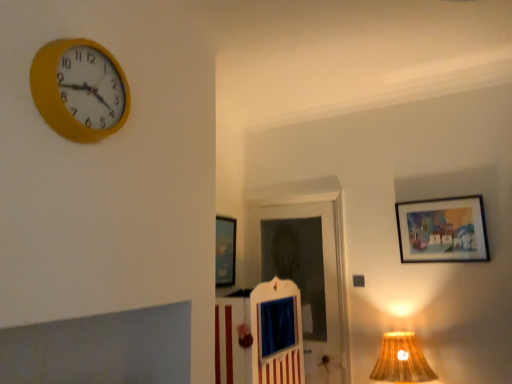
Question: Looking at the image, does metallic silver picture frame at center, which is counted as the first picture frame, starting from the left, seem bigger or smaller compared to matte wooden picture frame at upper right, which is counted as the 1th picture frame, starting from the front?

Choices:
 (A) big
 (B) small

Answer: (A)

Question: Is metallic silver picture frame at center, which is counted as the first picture frame, starting from the left, in front of or behind matte wooden picture frame at upper right, arranged as the 2th picture frame when viewed from the back, in the image?

Choices:
 (A) front
 (B) behind

Answer: (B)

Question: Which object is the farthest from the yellow plastic wall clock at upper left?

Choices:
 (A) metallic silver picture frame at center, which is counted as the first picture frame, starting from the left
 (B) braided fabric lampshade at lower right
 (C) white wooden door at center
 (D) matte wooden picture frame at upper right, the second picture frame when ordered from left to right

Answer: (D)

Question: Estimate the real-world distances between objects in this image. Which object is closer to the matte wooden picture frame at upper right, which is counted as the 1th picture frame, starting from the front?

Choices:
 (A) white wooden door at center
 (B) braided fabric lampshade at lower right
 (C) metallic silver picture frame at center, arranged as the second picture frame when viewed from the right
 (D) yellow plastic wall clock at upper left

Answer: (B)